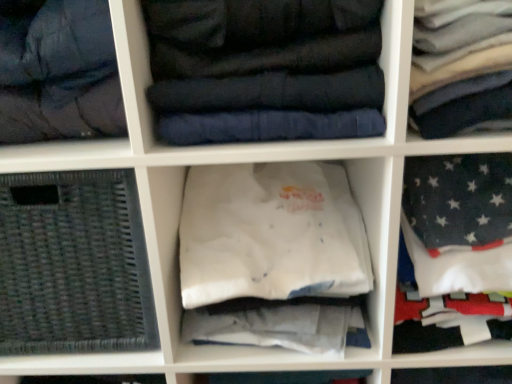
Question: Is dark gray quilted jacket at upper left outside of black woven basket at lower left?

Choices:
 (A) yes
 (B) no

Answer: (A)

Question: Is the position of dark gray quilted jacket at upper left more distant than that of black woven basket at lower left?

Choices:
 (A) yes
 (B) no

Answer: (B)

Question: Is the surface of dark gray quilted jacket at upper left in direct contact with black woven basket at lower left?

Choices:
 (A) yes
 (B) no

Answer: (B)

Question: Does dark gray quilted jacket at upper left have a lesser width compared to black woven basket at lower left?

Choices:
 (A) no
 (B) yes

Answer: (B)

Question: Does dark gray quilted jacket at upper left have a greater height compared to black woven basket at lower left?

Choices:
 (A) yes
 (B) no

Answer: (B)

Question: Does point (130, 228) appear closer or farther from the camera than point (225, 210)?

Choices:
 (A) closer
 (B) farther

Answer: (A)

Question: Considering the positions of black woven basket at lower left and white cotton t-shirt at center, acting as the 2th clothing starting from the left, in the image, is black woven basket at lower left taller or shorter than white cotton t-shirt at center, acting as the 2th clothing starting from the left,?

Choices:
 (A) short
 (B) tall

Answer: (B)

Question: From a real-world perspective, is black woven basket at lower left positioned above or below white cotton t-shirt at center, which is the second clothing in right-to-left order?

Choices:
 (A) below
 (B) above

Answer: (B)

Question: Considering their positions, is black woven basket at lower left located in front of or behind white cotton t-shirt at center, which is the second clothing in right-to-left order?

Choices:
 (A) front
 (B) behind

Answer: (B)

Question: Considering the positions of dark gray quilted jacket at upper left and white cotton shirt at upper right, marked as the third clothing in a left-to-right arrangement, in the image, is dark gray quilted jacket at upper left taller or shorter than white cotton shirt at upper right, marked as the third clothing in a left-to-right arrangement,?

Choices:
 (A) tall
 (B) short

Answer: (A)

Question: Do you think dark gray quilted jacket at upper left is within white cotton shirt at upper right, the 1th clothing positioned from the right, or outside of it?

Choices:
 (A) outside
 (B) inside

Answer: (A)

Question: From the image's perspective, is dark gray quilted jacket at upper left located above or below white cotton shirt at upper right, the 1th clothing positioned from the right?

Choices:
 (A) above
 (B) below

Answer: (B)

Question: From a real-world perspective, relative to white cotton shirt at upper right, marked as the third clothing in a left-to-right arrangement, is dark gray quilted jacket at upper left vertically above or below?

Choices:
 (A) below
 (B) above

Answer: (B)

Question: Based on their sizes in the image, would you say white cotton shirt at upper right, the 1th clothing positioned from the right, is bigger or smaller than dark blue quilted jacket at center, marked as the 1th clothing in a left-to-right arrangement?

Choices:
 (A) big
 (B) small

Answer: (B)

Question: Does point coord(496,54) appear closer or farther from the camera than point coord(251,132)?

Choices:
 (A) closer
 (B) farther

Answer: (A)